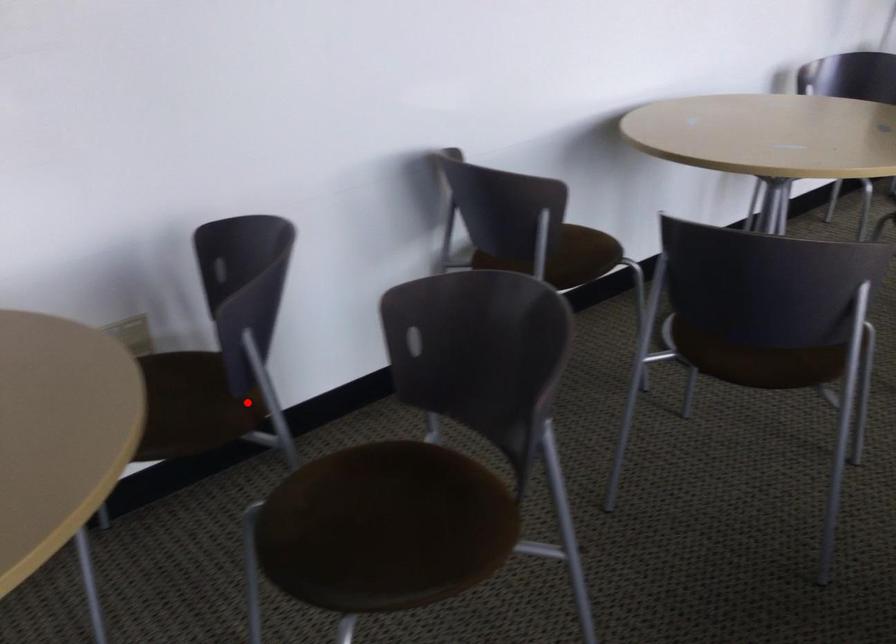
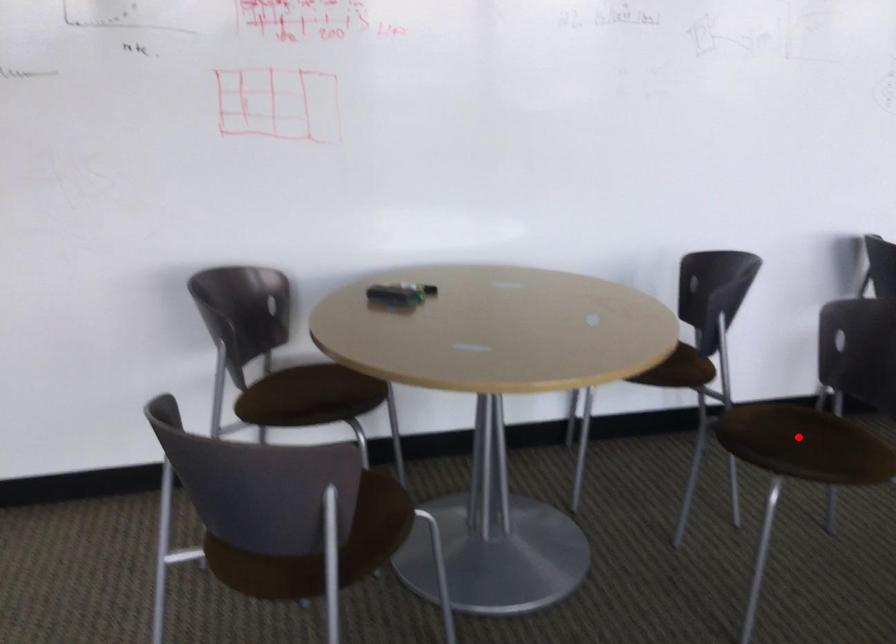
I am providing you with two images of the same scene from different viewpoints. A red point is marked on the first image and another point is marked on the second image. Are the points marked in image1 and image2 representing the same 3D position?

No